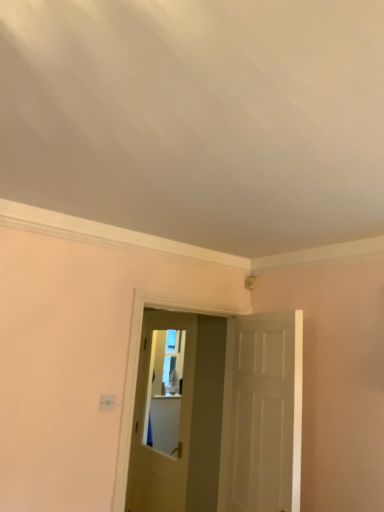
Question: In terms of width, does matte white door at center, positioned as the second door in front-to-back order, look wider or thinner when compared to white matte door at center, which is counted as the 2th door, starting from the back?

Choices:
 (A) thin
 (B) wide

Answer: (A)

Question: In the image, is matte white door at center, positioned as the second door in front-to-back order, positioned in front of or behind white matte door at center, which is counted as the 2th door, starting from the back?

Choices:
 (A) front
 (B) behind

Answer: (B)

Question: Estimate the real-world distances between objects in this image. Which object is farther from the matte white door at center, which is counted as the 1th door, starting from the back?

Choices:
 (A) white matte door at center, which is counted as the 2th door, starting from the back
 (B) white plastic light switch at lower left

Answer: (B)

Question: Which is farther from the white plastic light switch at lower left?

Choices:
 (A) matte white door at center, the second door when ordered from right to left
 (B) white matte door at center, which is the 1th door from front to back

Answer: (A)